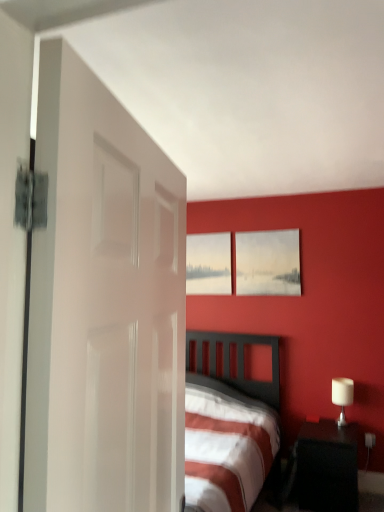
Question: Is matte gray picture frame at upper center, arranged as the second picture frame when viewed from the front, shorter than white glossy table lamp at right?

Choices:
 (A) no
 (B) yes

Answer: (A)

Question: Is white glossy table lamp at right at the back of matte gray picture frame at upper center, which ranks as the 1th picture frame in left-to-right order?

Choices:
 (A) yes
 (B) no

Answer: (B)

Question: Is the surface of matte gray picture frame at upper center, placed as the 2th picture frame when sorted from right to left, in direct contact with white glossy table lamp at right?

Choices:
 (A) yes
 (B) no

Answer: (B)

Question: From a real-world perspective, is matte gray picture frame at upper center, which ranks as the 1th picture frame in left-to-right order, under white glossy table lamp at right?

Choices:
 (A) yes
 (B) no

Answer: (B)

Question: Does matte gray picture frame at upper center, which ranks as the 1th picture frame in left-to-right order, have a lesser width compared to white glossy table lamp at right?

Choices:
 (A) no
 (B) yes

Answer: (B)

Question: Is white glossy table lamp at right inside the boundaries of white glossy door at left, or outside?

Choices:
 (A) inside
 (B) outside

Answer: (B)

Question: Considering the positions of white glossy table lamp at right and white glossy door at left in the image, is white glossy table lamp at right bigger or smaller than white glossy door at left?

Choices:
 (A) small
 (B) big

Answer: (A)

Question: In the image, is white glossy table lamp at right positioned in front of or behind white glossy door at left?

Choices:
 (A) behind
 (B) front

Answer: (A)

Question: Visually, is white glossy table lamp at right positioned to the left or to the right of white glossy door at left?

Choices:
 (A) right
 (B) left

Answer: (A)

Question: Is point (332, 393) positioned closer to the camera than point (304, 477)?

Choices:
 (A) closer
 (B) farther

Answer: (B)

Question: Based on their sizes in the image, would you say white glossy table lamp at right is bigger or smaller than black glossy nightstand at lower right?

Choices:
 (A) small
 (B) big

Answer: (A)

Question: Is white glossy table lamp at right in front of or behind black glossy nightstand at lower right in the image?

Choices:
 (A) behind
 (B) front

Answer: (A)

Question: Which is correct: white glossy table lamp at right is inside black glossy nightstand at lower right, or outside of it?

Choices:
 (A) inside
 (B) outside

Answer: (B)

Question: From the image's perspective, is matte white picture frame at upper center, the 1th picture frame from the right, located above or below matte gray picture frame at upper center, which ranks as the 1th picture frame in left-to-right order?

Choices:
 (A) above
 (B) below

Answer: (A)

Question: Is point (241, 233) positioned closer to the camera than point (218, 287)?

Choices:
 (A) closer
 (B) farther

Answer: (A)